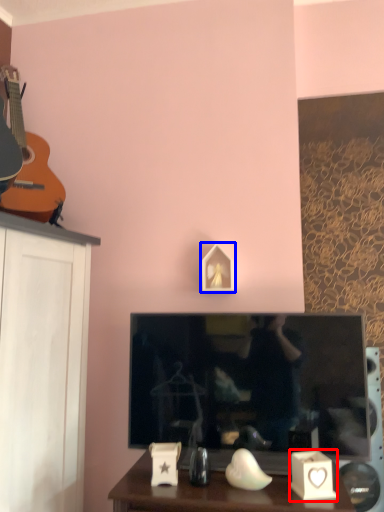
Question: Which object is closer to the camera taking this photo, candle holder (highlighted by a red box) or picture frame (highlighted by a blue box)?

Choices:
 (A) candle holder
 (B) picture frame

Answer: (A)